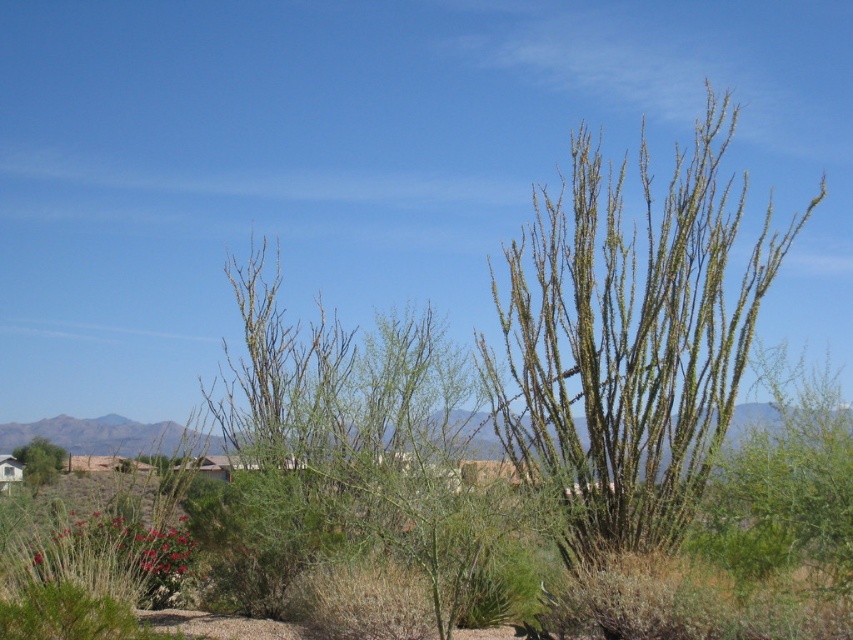
Question: Is green spiny bush at center above green spiny bush at lower left?

Choices:
 (A) yes
 (B) no

Answer: (A)

Question: Can you confirm if green spiny bush at center is bigger than green spiny bush at lower left?

Choices:
 (A) yes
 (B) no

Answer: (B)

Question: Among these points, which one is farthest from the camera?

Choices:
 (A) (26, 474)
 (B) (727, 243)

Answer: (A)

Question: Can you confirm if green spiny bush at center is positioned to the left of green spiny bush at lower left?

Choices:
 (A) no
 (B) yes

Answer: (A)